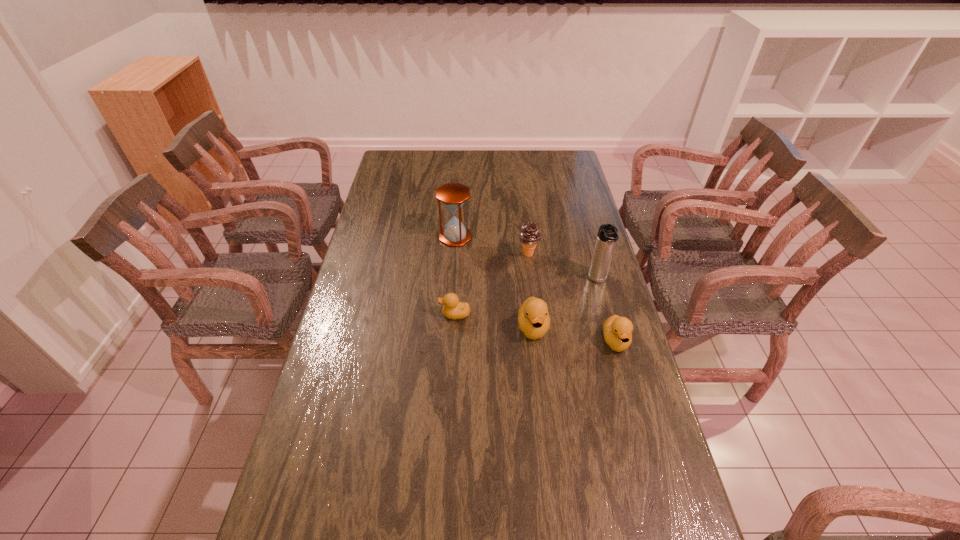
Find the location of `object that stands as the closest to the tallest duckling`. object that stands as the closest to the tallest duckling is located at coordinates (453, 309).

Select which object is the second closest to the shortest object. Please provide its 2D coordinates. Your answer should be formatted as a tuple, i.e. [(x, y)], where the tuple contains the x and y coordinates of a point satisfying the conditions above.

[(529, 236)]

The height and width of the screenshot is (540, 960). In order to click on duckling that is the second closest to the third shortest object in this screenshot , I will do `click(617, 330)`.

Identify which duckling is the second closest to the second duckling from right to left. Please provide its 2D coordinates. Your answer should be formatted as a tuple, i.e. [(x, y)], where the tuple contains the x and y coordinates of a point satisfying the conditions above.

[(617, 330)]

Where is `vacant region that satisfies the following two spatial constraints: 1. on the handle side of the thermos bottle; 2. on the face of the shortest object`? The height and width of the screenshot is (540, 960). vacant region that satisfies the following two spatial constraints: 1. on the handle side of the thermos bottle; 2. on the face of the shortest object is located at coordinates (607, 314).

At what (x,y) coordinates should I click in order to perform the action: click on vacant area in the image that satisfies the following two spatial constraints: 1. on the front side of the fifth nearest object; 2. on the face of the shortest object. Please return your answer as a coordinate pair (x, y). Looking at the image, I should click on (536, 314).